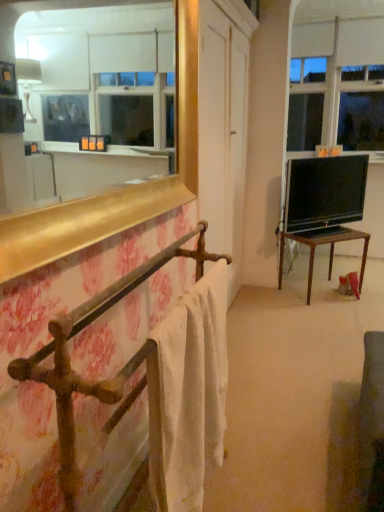
Question: Considering the positions of point (291, 196) and point (319, 46), is point (291, 196) closer or farther from the camera than point (319, 46)?

Choices:
 (A) closer
 (B) farther

Answer: (A)

Question: Looking at the image, does black glossy tv at right seem bigger or smaller compared to transparent glass window at upper right?

Choices:
 (A) big
 (B) small

Answer: (B)

Question: Which object is the closest to the wooden table at right?

Choices:
 (A) rusty metal towel rack at left
 (B) white cotton towel at left
 (C) black glossy tv at right
 (D) transparent glass window at upper right

Answer: (C)

Question: Which is nearer to the transparent glass window at upper right?

Choices:
 (A) wooden table at right
 (B) white cotton towel at left
 (C) black glossy tv at right
 (D) rusty metal towel rack at left

Answer: (C)